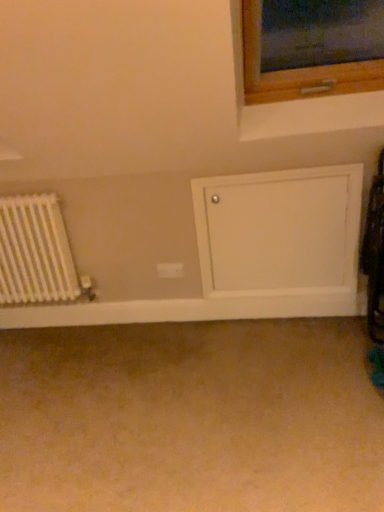
Question: In the image, is white plastic electric outlet at center positioned in front of or behind beige carpet at lower center?

Choices:
 (A) behind
 (B) front

Answer: (A)

Question: From their relative heights in the image, would you say white plastic electric outlet at center is taller or shorter than beige carpet at lower center?

Choices:
 (A) tall
 (B) short

Answer: (A)

Question: Estimate the real-world distances between objects in this image. Which object is closer to the white matte radiator at left?

Choices:
 (A) beige carpet at lower center
 (B) white painted wood door at lower right
 (C) white plastic electric outlet at center

Answer: (C)

Question: Which object is positioned farthest from the beige carpet at lower center?

Choices:
 (A) white matte radiator at left
 (B) white plastic electric outlet at center
 (C) white painted wood door at lower right

Answer: (B)